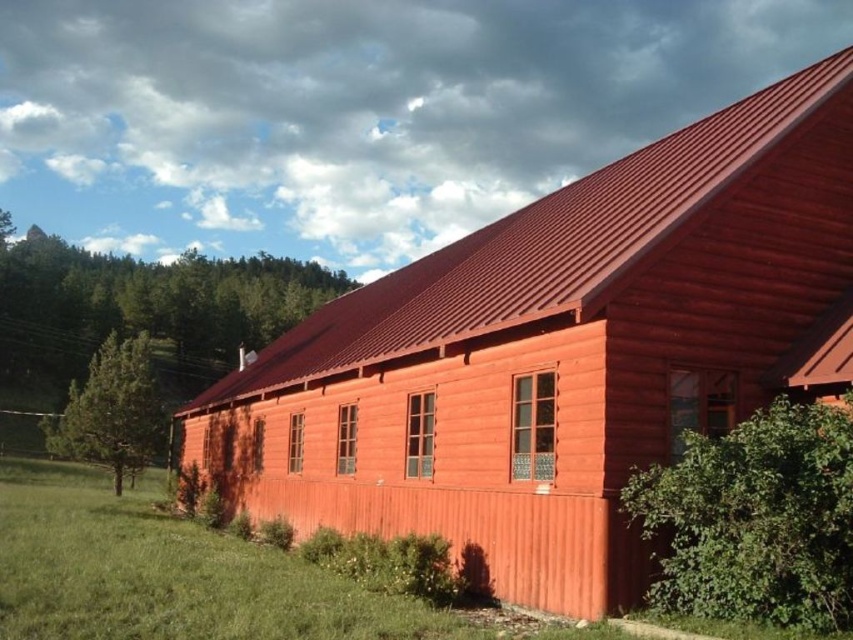
Question: Is the position of metallic red roof at upper center more distant than that of green leafy tree at upper left?

Choices:
 (A) no
 (B) yes

Answer: (A)

Question: Among these objects, which one is farthest from the camera?

Choices:
 (A) green leafy tree at upper left
 (B) green leafy bush at lower right

Answer: (A)

Question: Which is farther from the green leafy bush at lower right?

Choices:
 (A) green textured pine tree at left
 (B) metallic red roof at upper center
 (C) green leafy tree at upper left

Answer: (C)

Question: Among these objects, which one is nearest to the camera?

Choices:
 (A) green leafy tree at upper left
 (B) metallic red roof at upper center
 (C) green textured pine tree at left

Answer: (B)

Question: Is metallic red roof at upper center below green leafy bush at lower right?

Choices:
 (A) yes
 (B) no

Answer: (B)

Question: Can you confirm if green leafy bush at lower right is positioned above green textured pine tree at left?

Choices:
 (A) no
 (B) yes

Answer: (B)